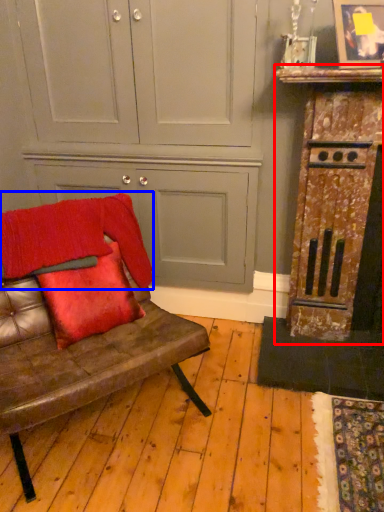
Question: Which of the following is the closest to the observer, dresser (highlighted by a red box) or blanket (highlighted by a blue box)?

Choices:
 (A) dresser
 (B) blanket

Answer: (B)